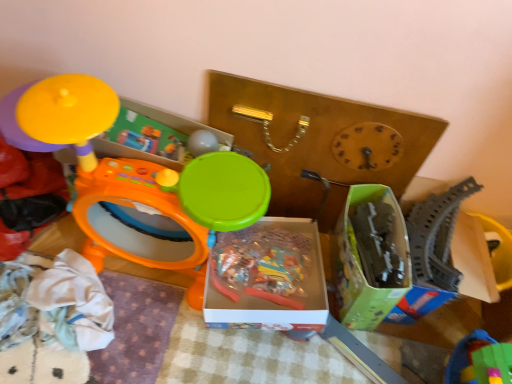
The height and width of the screenshot is (384, 512). What are the coordinates of `free region on the left part of translucent plastic box at center, which is the first storage box in left-to-right order` in the screenshot? It's located at (160, 289).